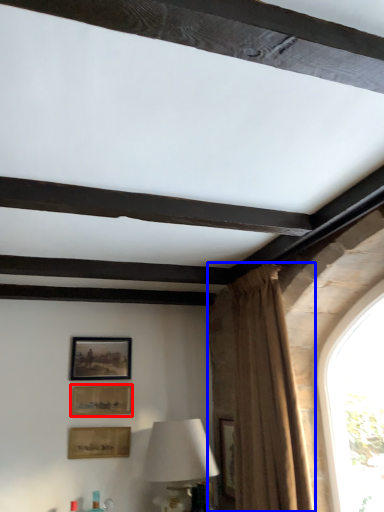
Question: Which object appears farthest to the camera in this image, picture frame (highlighted by a red box) or curtain (highlighted by a blue box)?

Choices:
 (A) picture frame
 (B) curtain

Answer: (A)